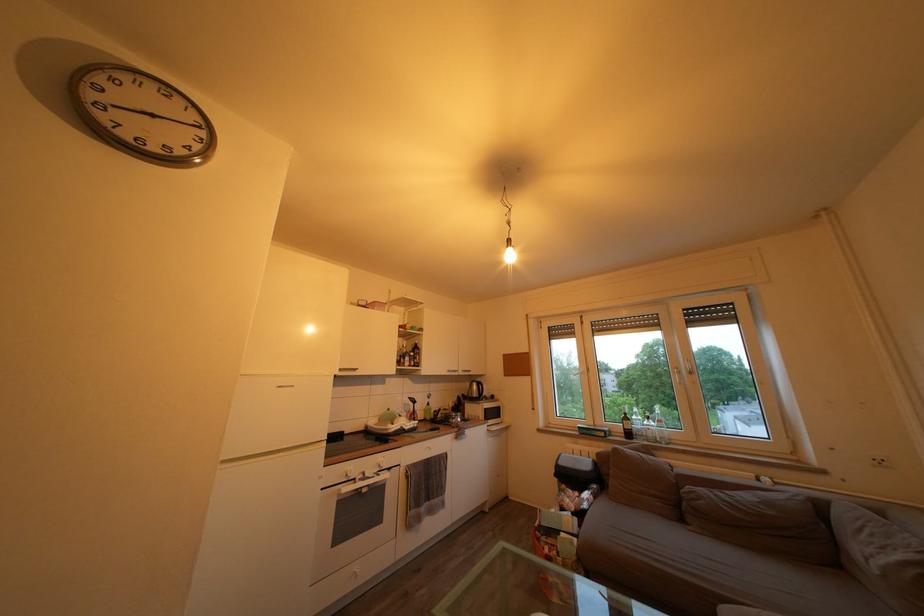
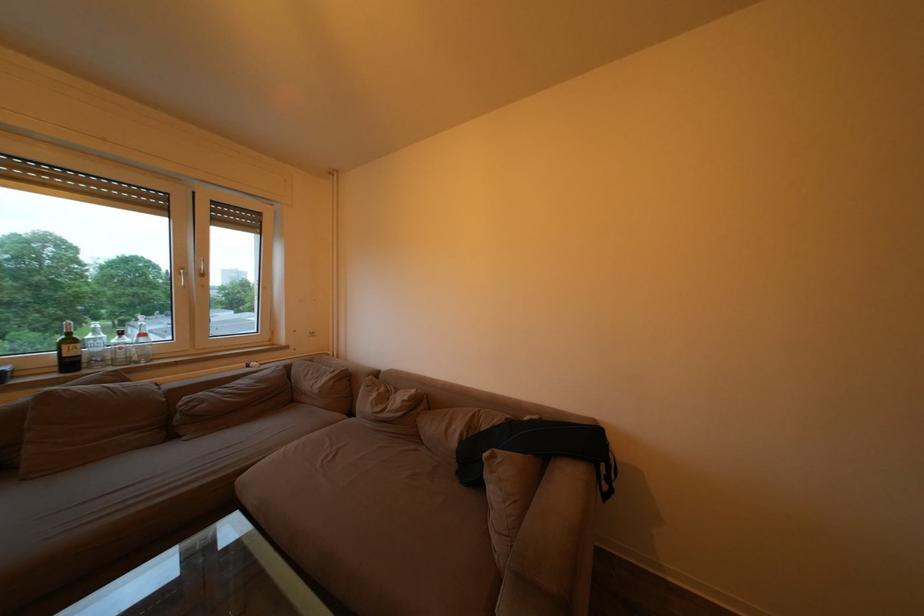
Locate, in the second image, the point that corresponds to the point at 689,525 in the first image.

(178, 443)